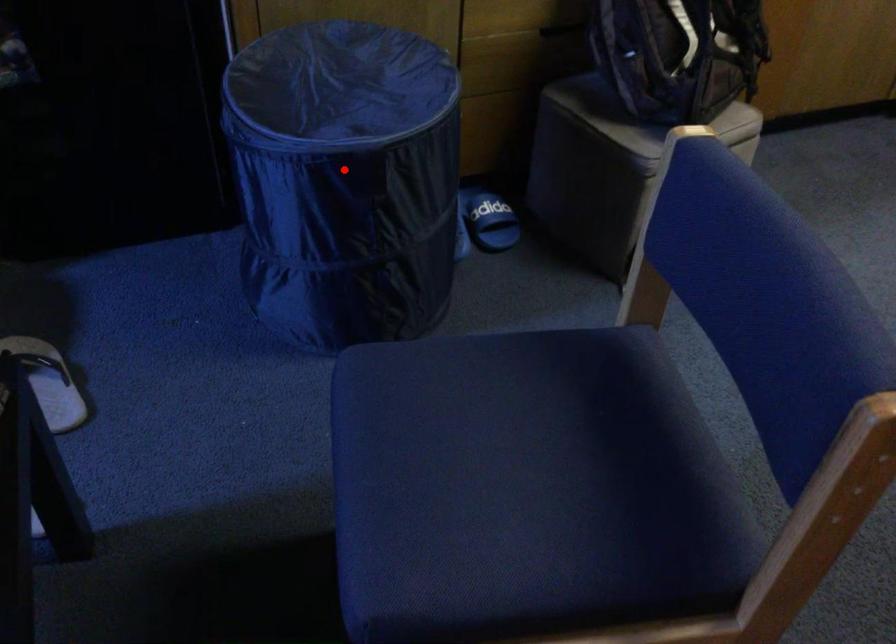
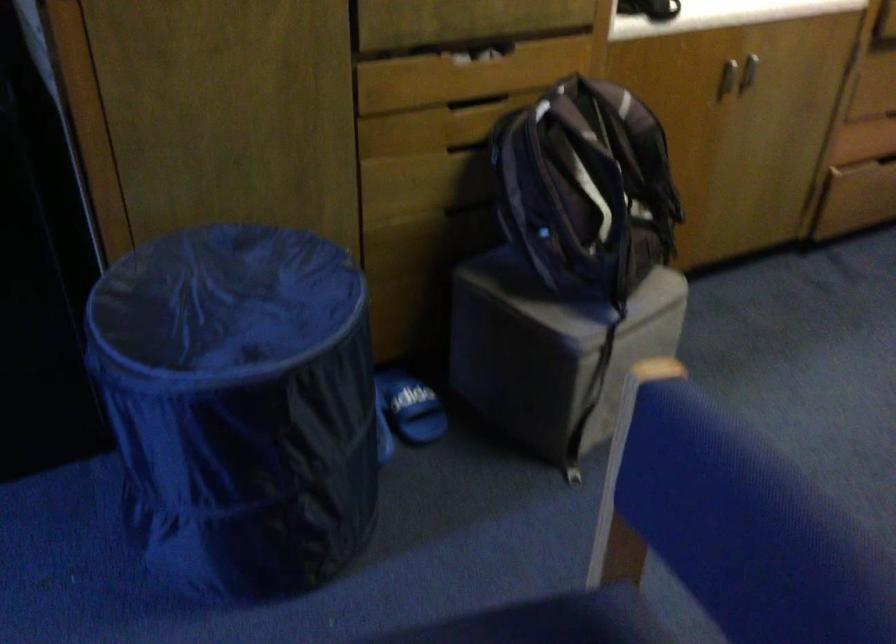
Question: I am providing you with two images of the same scene from different viewpoints. A red point is shown in image1. For the corresponding object point in image2, is it positioned nearer or farther from the camera?

Choices:
 (A) Nearer
 (B) Farther

Answer: (A)